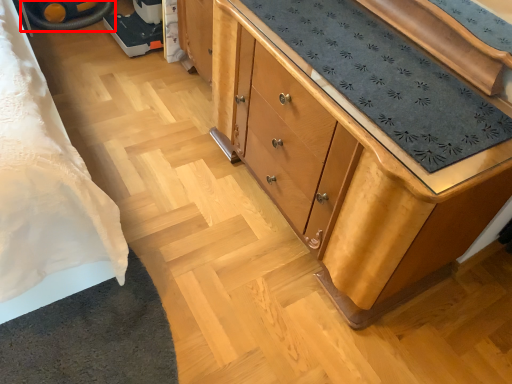
Question: From the image's perspective, considering the relative positions of wheel (annotated by the red box) and chest of drawers in the image provided, where is wheel (annotated by the red box) located with respect to the staircase?

Choices:
 (A) above
 (B) below

Answer: (A)